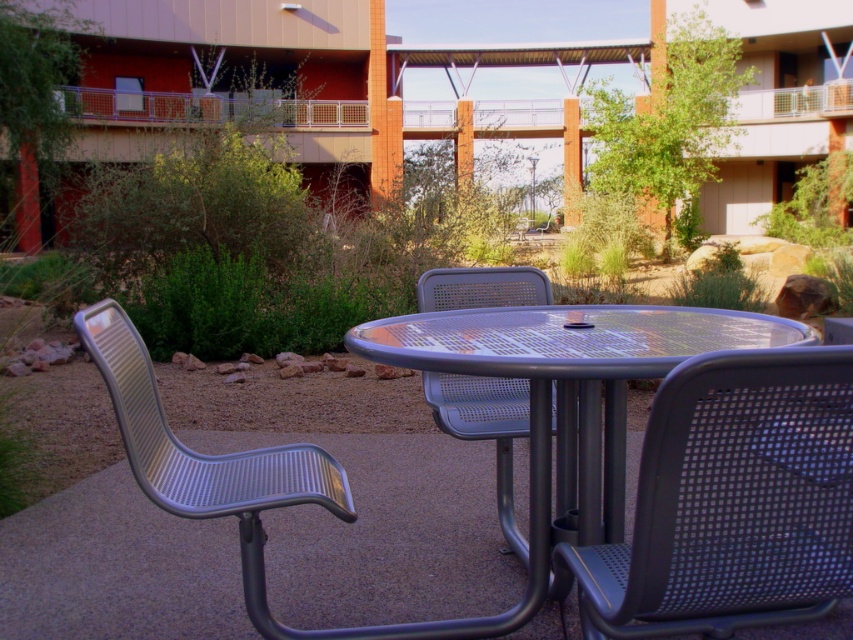
Between metallic mesh table at center and metallic mesh chair at left, which one has less height?

metallic mesh table at center is shorter.

What do you see at coordinates (566, 339) in the screenshot? I see `metallic mesh table at center` at bounding box center [566, 339].

Find the location of a particular element. This screenshot has width=853, height=640. metallic mesh table at center is located at coordinates (566, 339).

Is metallic mesh chair at left to the left of metal mesh chair at center from the viewer's perspective?

Yes, metallic mesh chair at left is to the left of metal mesh chair at center.

This screenshot has width=853, height=640. I want to click on metallic mesh chair at left, so point(207,461).

Does metallic mesh table at center have a lesser width compared to metal mesh chair at center?

Incorrect, metallic mesh table at center's width is not less than metal mesh chair at center's.

Does metallic mesh table at center appear over metal mesh chair at center?

Indeed, metallic mesh table at center is positioned over metal mesh chair at center.

Is point (666, 352) more distant than point (444, 387)?

That is False.

Where is `metallic mesh table at center`? Image resolution: width=853 pixels, height=640 pixels. metallic mesh table at center is located at coordinates (566, 339).